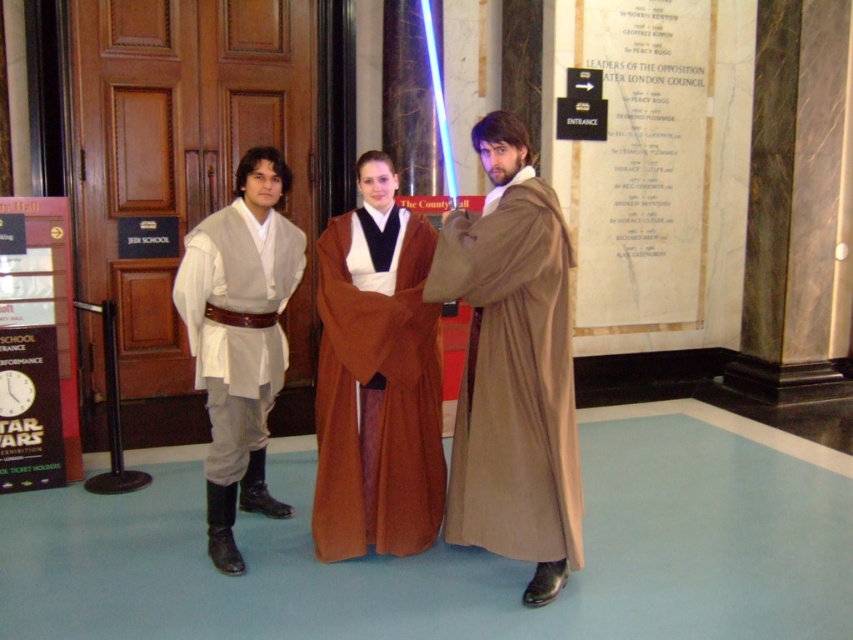
Which is below, brown woolen robe at center or white matte robe at left?

brown woolen robe at center is lower down.

Is point (444, 224) farther from camera compared to point (190, 348)?

No, it is in front of (190, 348).

Locate an element on the screen. brown woolen robe at center is located at coordinates (512, 368).

Is brown satin robe at center shorter than white matte robe at left?

No, brown satin robe at center is not shorter than white matte robe at left.

What do you see at coordinates (376, 378) in the screenshot? I see `brown satin robe at center` at bounding box center [376, 378].

The image size is (853, 640). I want to click on brown satin robe at center, so click(376, 378).

Which is behind, point (477, 540) or point (369, 150)?

Positioned behind is point (369, 150).

Is brown woolen robe at center to the right of brown satin robe at center from the viewer's perspective?

Yes, brown woolen robe at center is to the right of brown satin robe at center.

Which is in front, point (537, 390) or point (364, 372)?

Point (537, 390)

Locate an element on the screen. This screenshot has width=853, height=640. brown woolen robe at center is located at coordinates (512, 368).